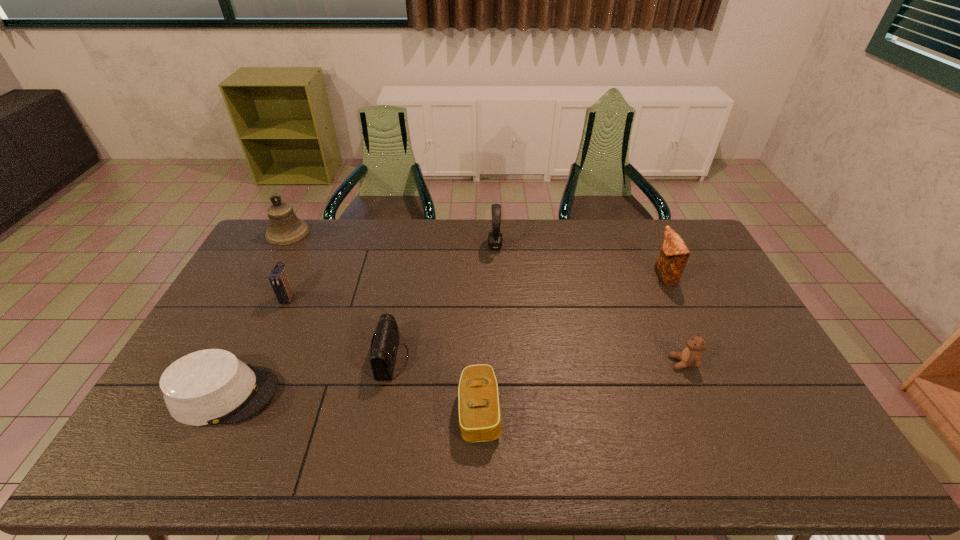
The height and width of the screenshot is (540, 960). In order to click on vacant space located on the front-facing side of the headset in this screenshot , I will do `click(413, 246)`.

Locate an element on the screen. This screenshot has height=540, width=960. free region located 0.190m on the front-facing side of the headset is located at coordinates (439, 246).

You are a GUI agent. You are given a task and a screenshot of the screen. Output one action in this format:
    pyautogui.click(x=<x>, y=<y>)
    Task: Click on the vacant space located 0.270m on the front-facing side of the headset
    The image size is (960, 540).
    Given the screenshot: What is the action you would take?
    pyautogui.click(x=418, y=246)

Find the location of a particular element. free space located on the open side of the tallest clutch bag is located at coordinates (570, 277).

This screenshot has height=540, width=960. Identify the location of free spot located 0.340m on the open side of the tallest clutch bag. (559, 277).

You are a GUI agent. You are given a task and a screenshot of the screen. Output one action in this format:
    pyautogui.click(x=<x>, y=<y>)
    Task: Click on the free space located on the open side of the tallest clutch bag
    The image size is (960, 540).
    Given the screenshot: What is the action you would take?
    pyautogui.click(x=615, y=277)

This screenshot has width=960, height=540. Identify the location of vacant area situated with the zip open on the third shortest clutch bag. (246, 390).

I want to click on vacant area situated on the front-facing side of the teddy bear, so click(x=602, y=363).

I want to click on vacant region located 0.230m on the front-facing side of the teddy bear, so pos(591,363).

Find the location of a particular element. Image resolution: width=960 pixels, height=540 pixels. free space located on the front-facing side of the teddy bear is located at coordinates 609,363.